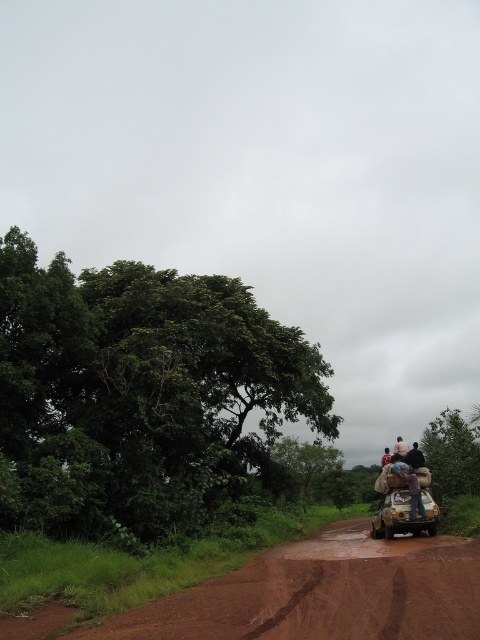
Is point (184, 332) more distant than point (408, 449)?

Yes, it is.

At what (x,y) coordinates should I click in order to perform the action: click on green leafy tree at left. Please return your answer as a coordinate pair (x, y). The width and height of the screenshot is (480, 640). Looking at the image, I should click on (140, 394).

The image size is (480, 640). Find the location of `green leafy tree at left`. green leafy tree at left is located at coordinates (140, 394).

Does green leafy tree at right have a lesser width compared to metallic silver car at lower right?

No, green leafy tree at right is not thinner than metallic silver car at lower right.

Between point (437, 472) and point (406, 493), which one is positioned behind?

The point (437, 472) is behind.

This screenshot has height=640, width=480. Identify the location of green leafy tree at right. (452, 456).

Measure the distance from green leafy tree at left to dark blue shirt at upper right.

green leafy tree at left is 29.86 feet from dark blue shirt at upper right.

Is green leafy tree at left shorter than dark blue shirt at upper right?

Yes, green leafy tree at left is shorter than dark blue shirt at upper right.

Is point (37, 364) closer to camera compared to point (385, 456)?

No.

Locate an element on the screen. green leafy tree at left is located at coordinates (140, 394).